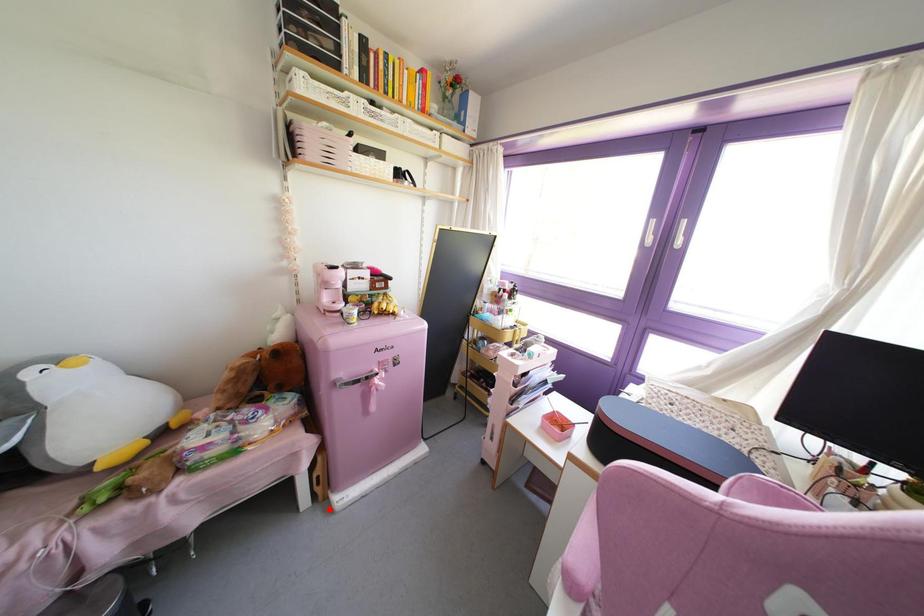
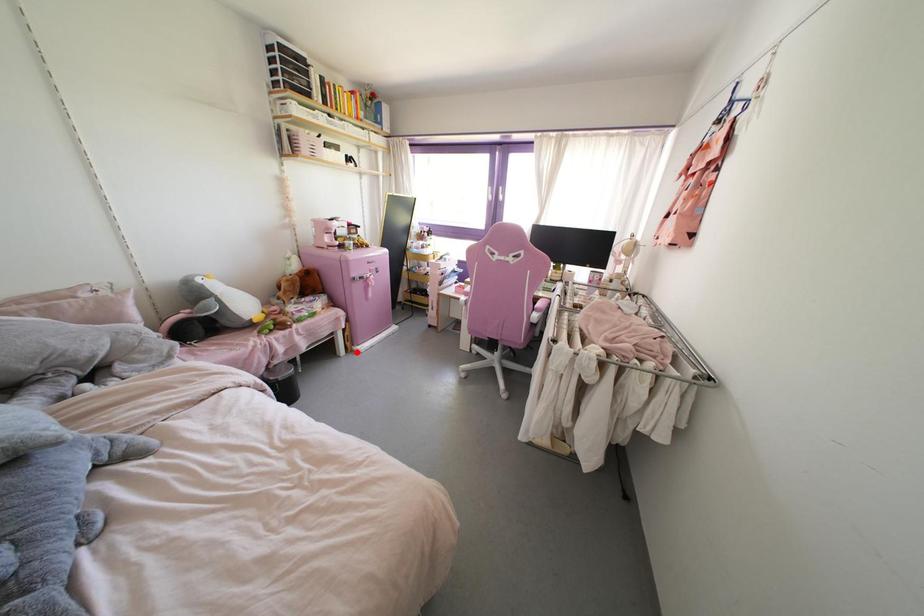
I am providing you with two images of the same scene from different viewpoints. A red point is marked on the first image and another point is marked on the second image. Is the red point in image1 aligned with the point shown in image2?

Yes